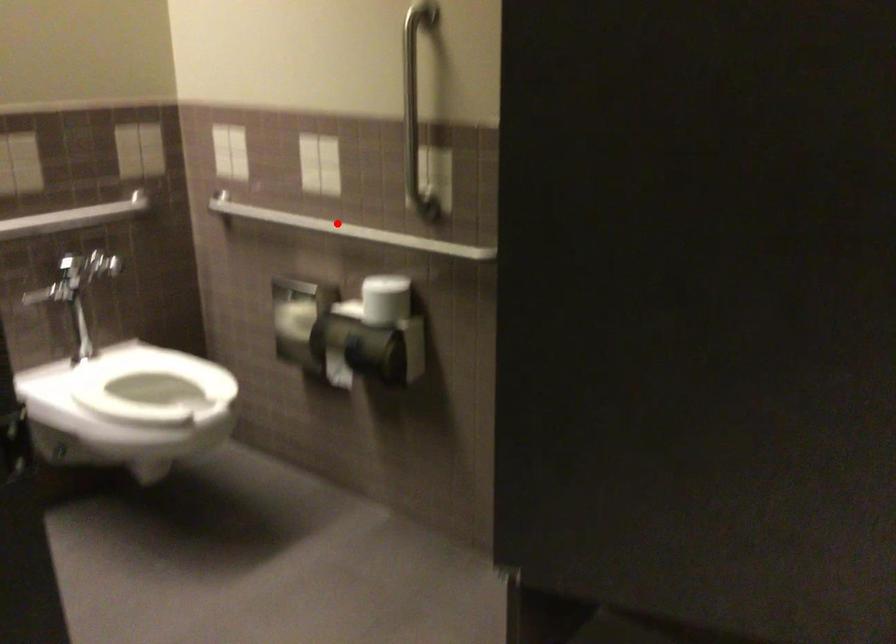
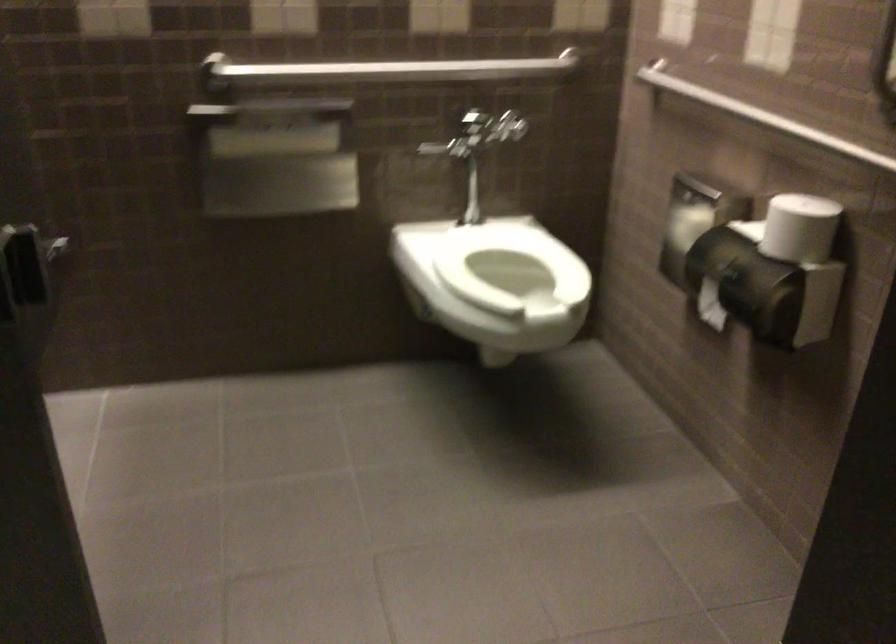
Locate, in the second image, the point that corresponds to the highlighted location in the first image.

(761, 116)